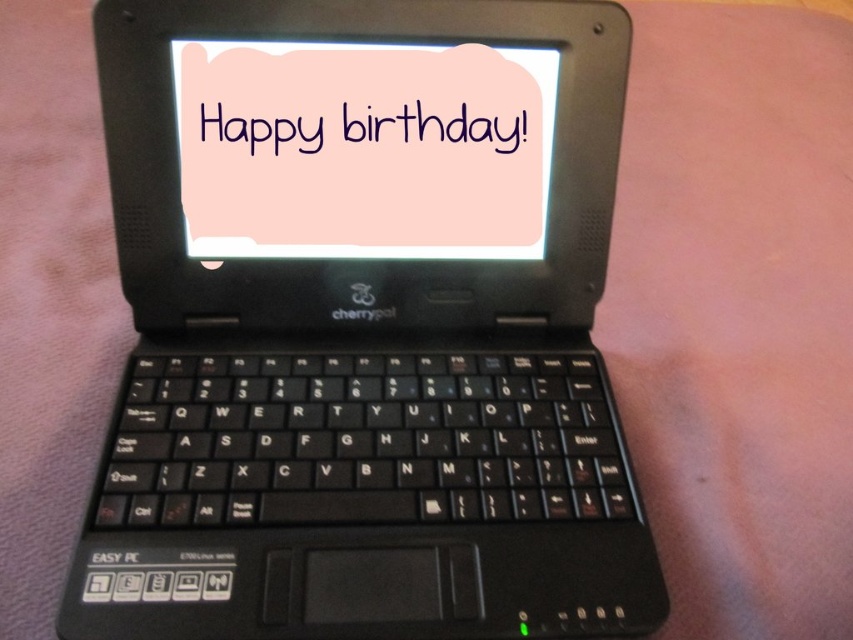
You are organizing a birthday party and need to place the black plastic laptop at center and the pink matte card at center on a table. The table has limited space between them. What is the minimum distance you need to keep between the two items to ensure they don not touch each other?

The black plastic laptop at center is 2.92 inches from pink matte card at center, so you need to keep at least 2.92 inches of space between them to prevent them from touching.

You are organizing a birthday party and need to set up decorations. You have a black plastic laptop at center and a pink matte card at center. According to the scene, where should you place the pink matte card relative to the black plastic laptop to match the image?

The black plastic laptop at center is in front of the pink matte card at center, so you should place the pink matte card behind the black plastic laptop at center to match the image.

You are organizing a birthday party and need to place decorations. You have a black plastic laptop at center and a pink matte card at center. According to the image, which object is positioned to the left?

The pink matte card at center is positioned to the left of the black plastic laptop at center.